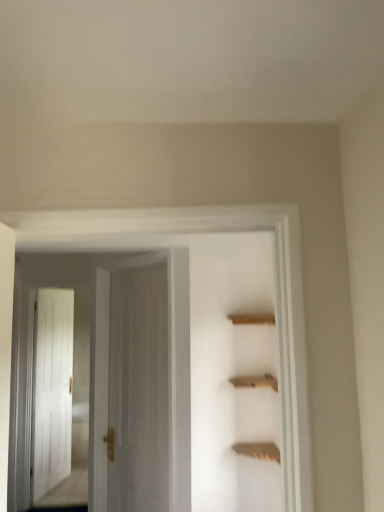
Question: Is white glossy door at center, positioned as the first door in back-to-front order, taller or shorter than white wooden door at center, the second door positioned from the back?

Choices:
 (A) short
 (B) tall

Answer: (B)

Question: From a real-world perspective, is white glossy door at center, acting as the 2th door starting from the front, above or below white wooden door at center, the second door positioned from the back?

Choices:
 (A) below
 (B) above

Answer: (A)

Question: Estimate the real-world distances between objects in this image. Which object is farther from the wooden shelf at upper center?

Choices:
 (A) white glossy door at center, positioned as the first door in back-to-front order
 (B) white wooden door at center, the second door positioned from the back

Answer: (A)

Question: Estimate the real-world distances between objects in this image. Which object is farther from the white glossy door at center, acting as the 2th door starting from the front?

Choices:
 (A) wooden shelf at upper center
 (B) white wooden door at center, the second door positioned from the back

Answer: (A)